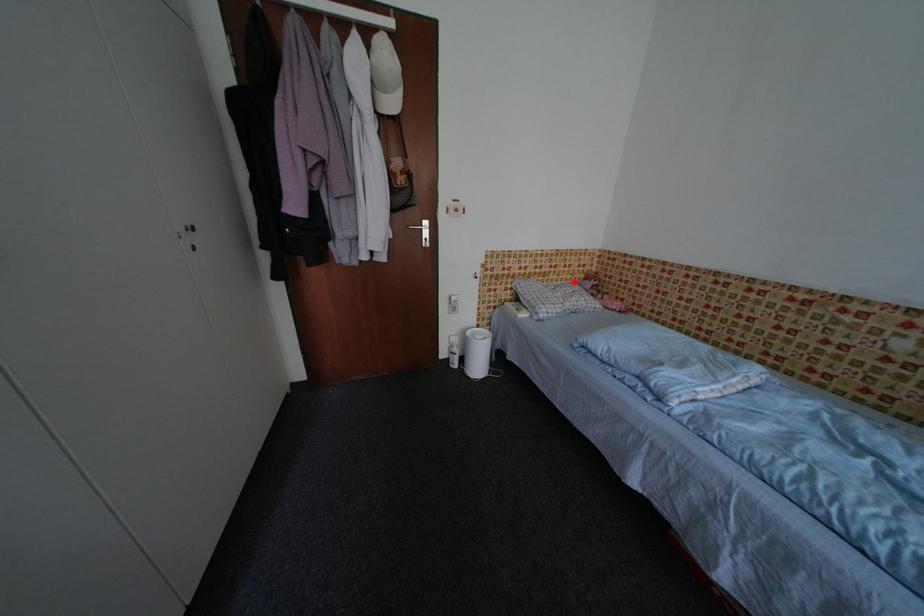
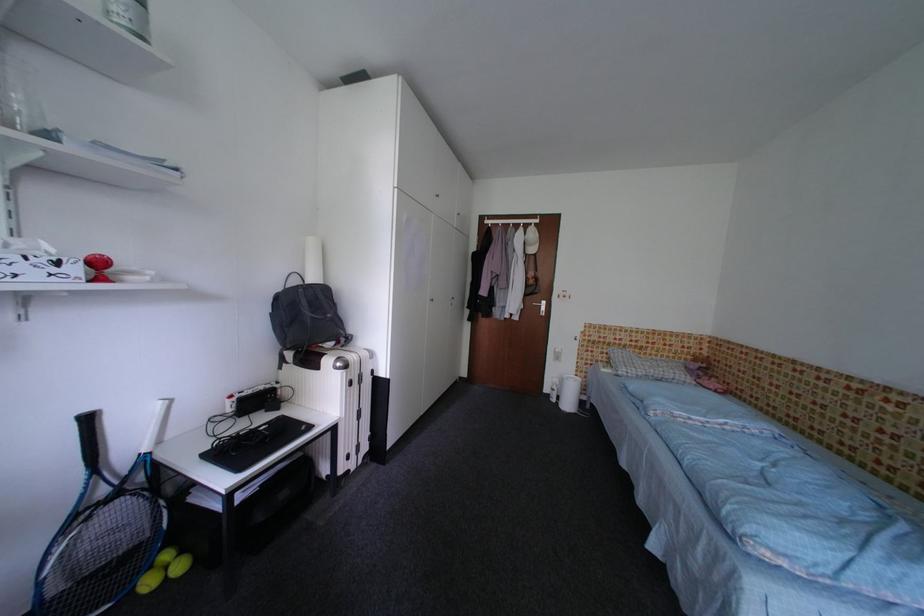
Question: I am providing you with two images of the same scene from different viewpoints. A red point is marked on the first image. Can you still see the location of the red point in image 2?

Choices:
 (A) Yes
 (B) No

Answer: (A)